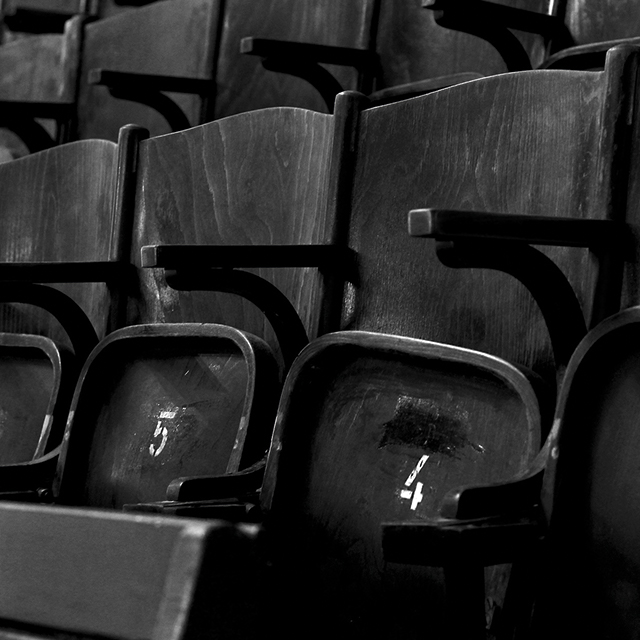
Where is `seats`? This screenshot has width=640, height=640. seats is located at coordinates [401, 427], [148, 415], [42, 396], [598, 450], [608, 19], [422, 52], [288, 17], [155, 36], [34, 60].